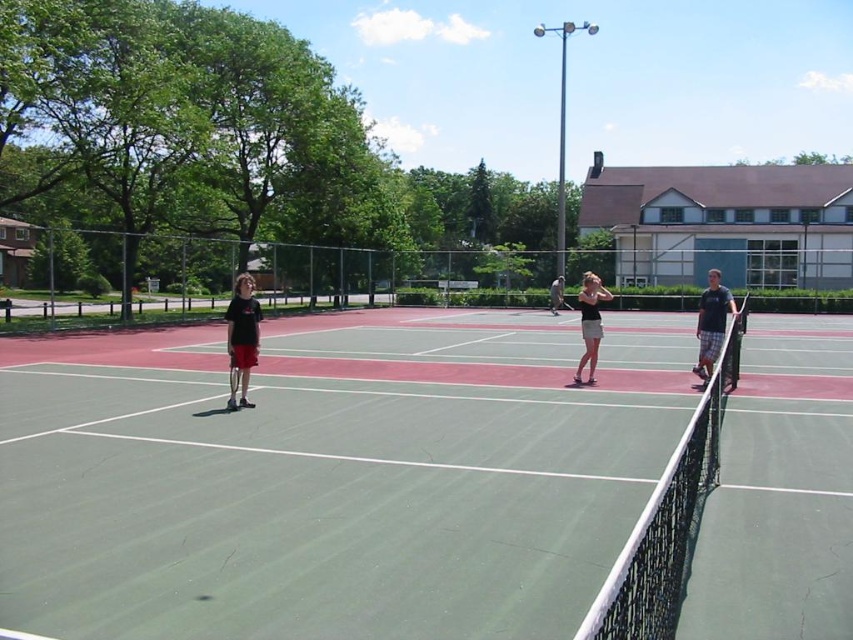
Question: Does matte black shorts at left have a lesser width compared to matte black shirt at right?

Choices:
 (A) yes
 (B) no

Answer: (A)

Question: Among these objects, which one is nearest to the camera?

Choices:
 (A) matte black shirt at right
 (B) matte black shorts at left
 (C) green rubber tennis court at center
 (D) black rubber racket at left

Answer: (C)

Question: Which of the following is the farthest from the observer?

Choices:
 (A) (697, 438)
 (B) (728, 310)
 (C) (229, 310)

Answer: (B)

Question: Where is matte black shorts at left located in relation to matte black shirt at right in the image?

Choices:
 (A) below
 (B) above

Answer: (A)

Question: Which object is the farthest from the white mesh net at center?

Choices:
 (A) matte black tank top at center
 (B) matte black shirt at right
 (C) black rubber racket at left
 (D) green rubber tennis court at center

Answer: (C)

Question: Is the position of white mesh net at center more distant than that of black rubber racket at left?

Choices:
 (A) yes
 (B) no

Answer: (B)